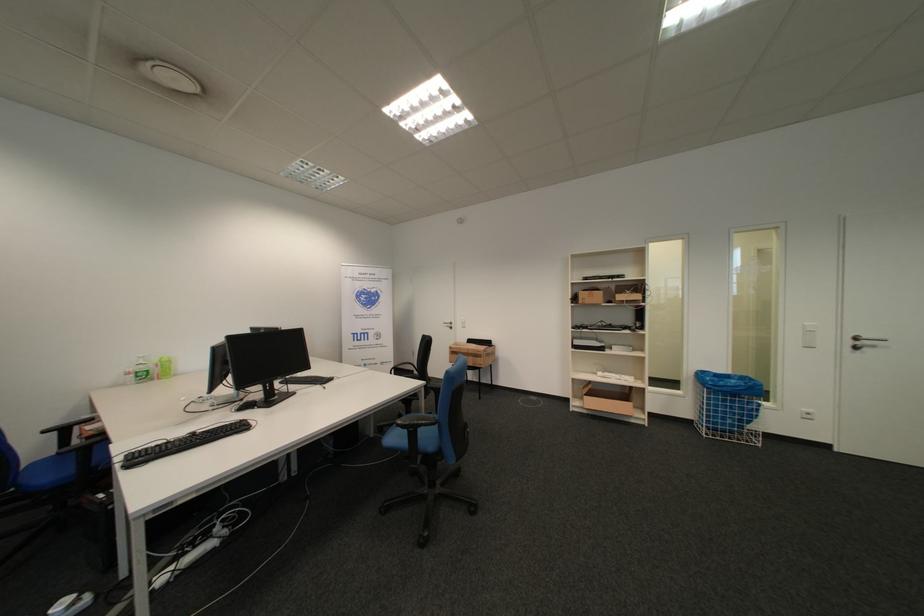
Locate an element on the screen. This screenshot has height=616, width=924. black chair armrest is located at coordinates [x=416, y=421].